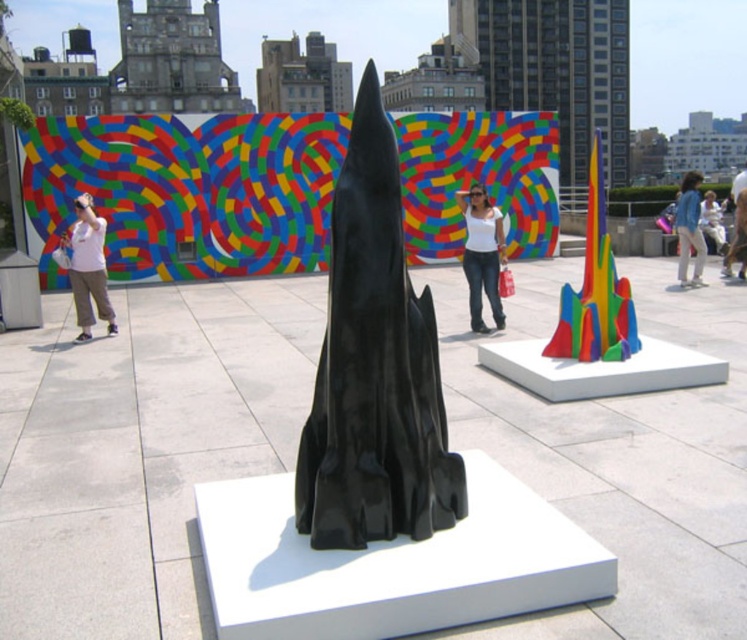
Consider the image. You are an art student analyzing the outdoor urban art installation. You notice the glossy black rocket at center and the multicolored plastic cone at right. Which sculpture is taller?

The multicolored plastic cone at right is taller than the glossy black rocket at center.

You are an art student who wants to sketch the glossy black rocket at center and the blue denim jacket at upper right. Since you have limited time, you want to draw the one that is closer to you first. Which object should you sketch first?

The glossy black rocket at center is closer to the viewer than the blue denim jacket at upper right, so you should sketch the glossy black rocket at center first.

You are an artist planning to photograph the glossy black rocket at center and the blue denim jacket at upper right. Which object should you focus on first if you want to capture both in a single frame while ensuring the closer object is sharp?

The glossy black rocket at center should be focused on first because it is closer to the viewer than the blue denim jacket at upper right. By focusing on the closer object, the depth of field will naturally include the background object more sharply.